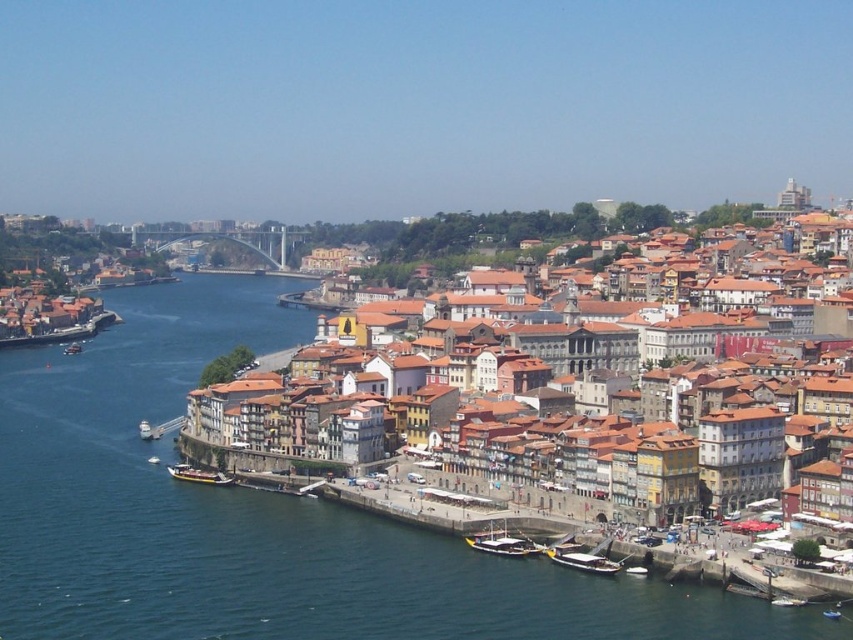
You are a photographer planning to capture the entire scene of the white glossy boat at lower left and the white plastic boat at center in one shot. Given that your camera can only focus on objects within a 100 meter width, can both boats be included in the frame without moving the camera?

The white glossy boat at lower left is larger than the white plastic boat at center, but their exact distance apart isn not specified. Without knowing the distance between them, it is impossible to determine if they can fit within the camera

Consider the image. You are a city planner assessing the riverfront area. You need to determine which boat, the wooden boat at lower center or the wooden polished boat at lower center, can accommodate more passengers based on their size. Which boat would you recommend?

The wooden polished boat at lower center occupies more space than the wooden boat at lower center, so it can accommodate more passengers.